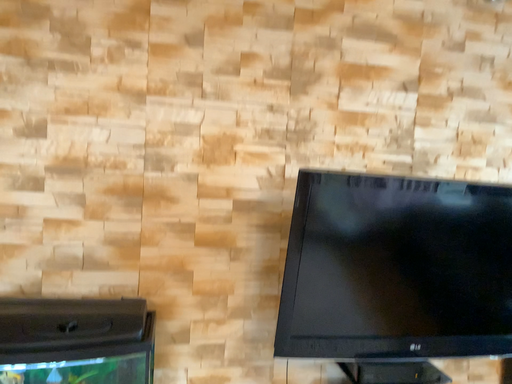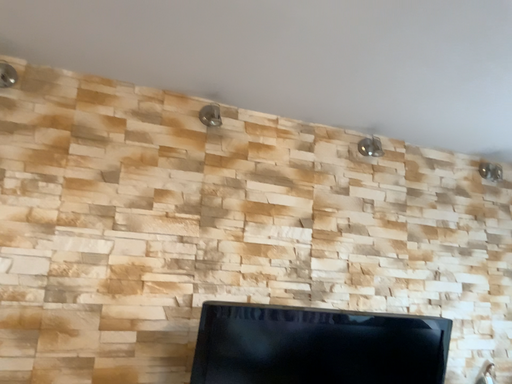
Question: How did the camera likely rotate when shooting the video?

Choices:
 (A) rotated downward
 (B) rotated upward

Answer: (B)